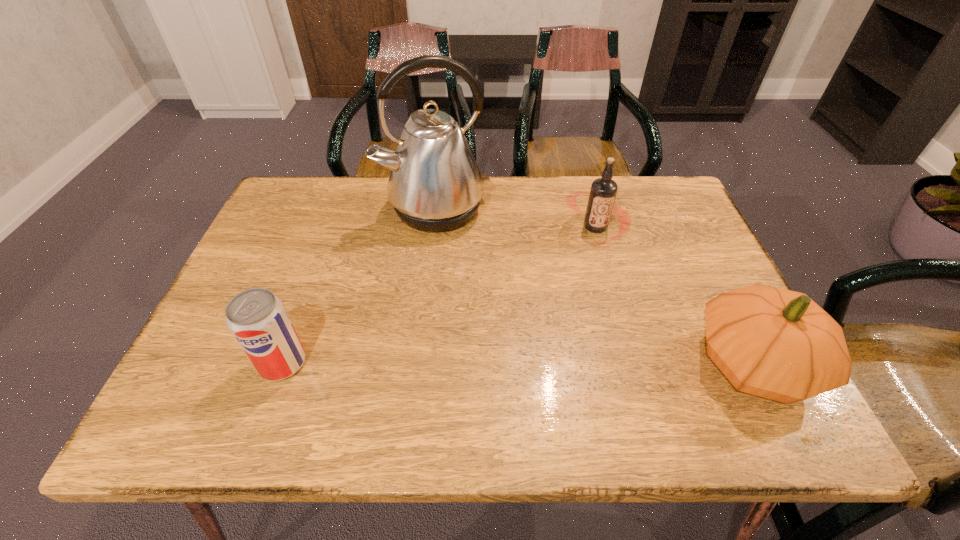
Where is `soda`? The height and width of the screenshot is (540, 960). soda is located at coordinates (256, 317).

Where is `the rightmost object`? the rightmost object is located at coordinates (779, 344).

At what (x,y) coordinates should I click in order to perform the action: click on the second object from right to left. Please return your answer as a coordinate pair (x, y). The image size is (960, 540). Looking at the image, I should click on (603, 191).

At what (x,y) coordinates should I click in order to perform the action: click on the third object from right to left. Please return your answer as a coordinate pair (x, y). Image resolution: width=960 pixels, height=540 pixels. Looking at the image, I should click on (435, 185).

Where is `kettle`? kettle is located at coordinates (435, 185).

You are a GUI agent. You are given a task and a screenshot of the screen. Output one action in this format:
    pyautogui.click(x=<x>, y=<y>)
    Task: Click on the vacant position located 0.210m on the right of the leftmost object
    This screenshot has height=540, width=960.
    Given the screenshot: What is the action you would take?
    pyautogui.click(x=409, y=363)

The height and width of the screenshot is (540, 960). What are the coordinates of `free space located on the label of the root beer` in the screenshot? It's located at (581, 355).

This screenshot has width=960, height=540. In order to click on vacant area located on the label of the root beer in this screenshot , I will do `click(582, 344)`.

The width and height of the screenshot is (960, 540). In order to click on free space located 0.120m on the label of the root beer in this screenshot , I will do `click(588, 280)`.

Find the location of a particular element. The image size is (960, 540). free space located from the spout of the tallest object is located at coordinates (470, 269).